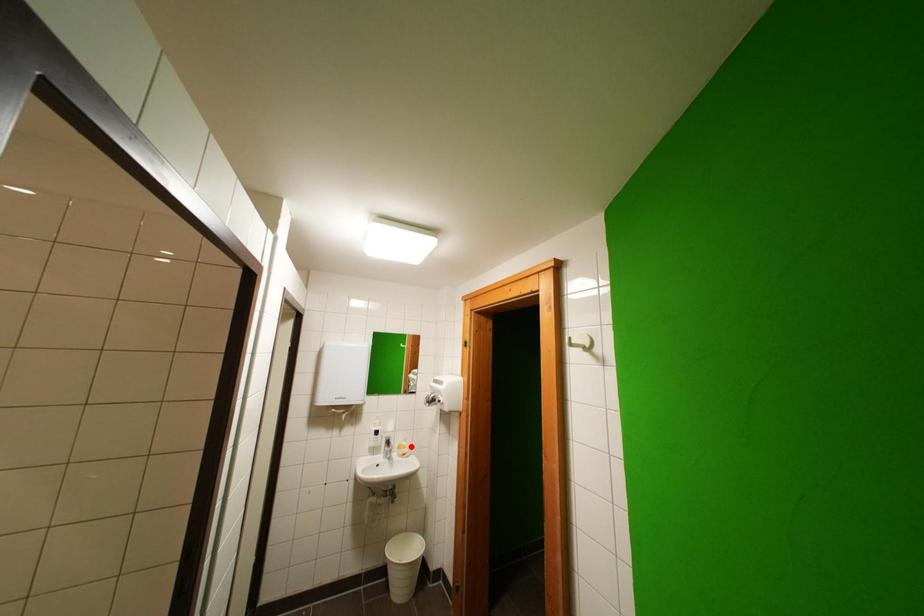
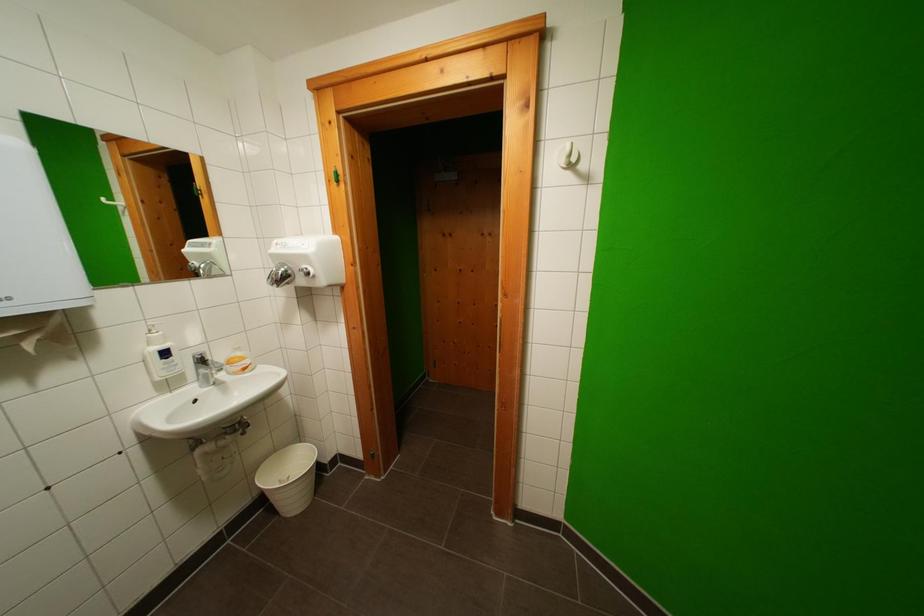
Question: I am providing you with two images of the same scene from different viewpoints. Given a red point in image1, look at the same physical point in image2. Is it:

Choices:
 (A) Closer to the viewpoint
 (B) Farther from the viewpoint

Answer: (A)